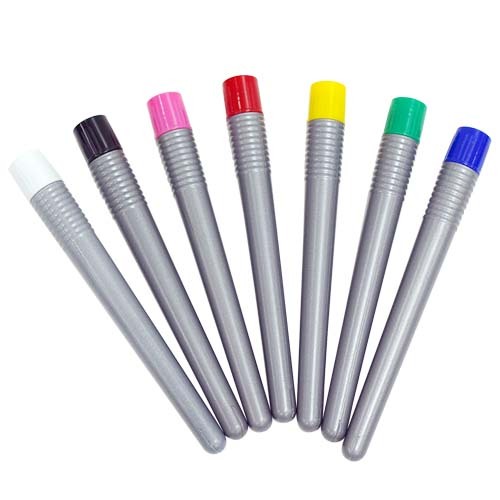
This screenshot has width=500, height=500. Find the location of `pens`. pens is located at coordinates (105, 278), (142, 231), (197, 193), (249, 177), (315, 189), (385, 196), (438, 212).